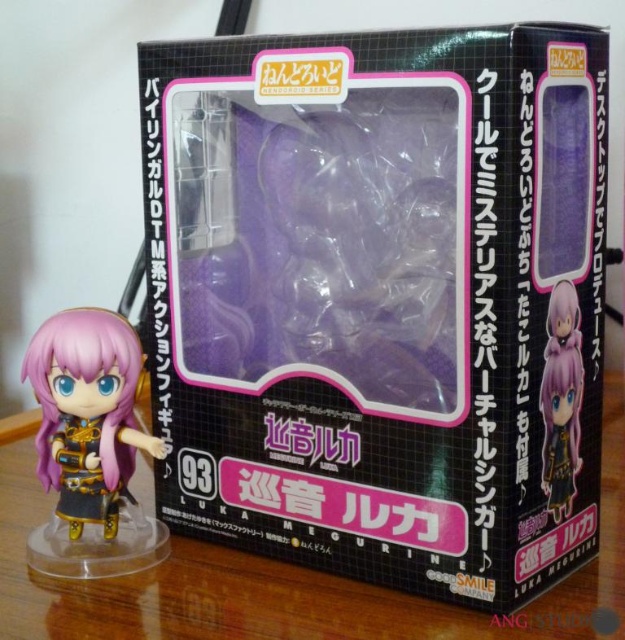
You are a collector who wants to display both the transparent plastic figure at center and the matte black figure at lower left on a shelf. Based on their positions in the image, which figure should you place higher up on the shelf to maintain the same arrangement?

The transparent plastic figure at center should be placed higher up on the shelf since it is positioned above the matte black figure at lower left in the image.

You are a customer at a toy store and see the transparent plastic table at lower center and the satin purple figurine at lower right. Which object is shorter?

The transparent plastic table at lower center is shorter than the satin purple figurine at lower right.

You are holding a camera and want to take a photo of the matte black figure at lower left. If the camera requires the subject to be at least 24 inches away to focus properly, will you need to move closer or farther away?

The matte black figure at lower left is currently 30.07 inches away from the camera. Since this distance is greater than the required 24 inches, you do not need to adjust your position. The camera should be able to focus properly at this distance.